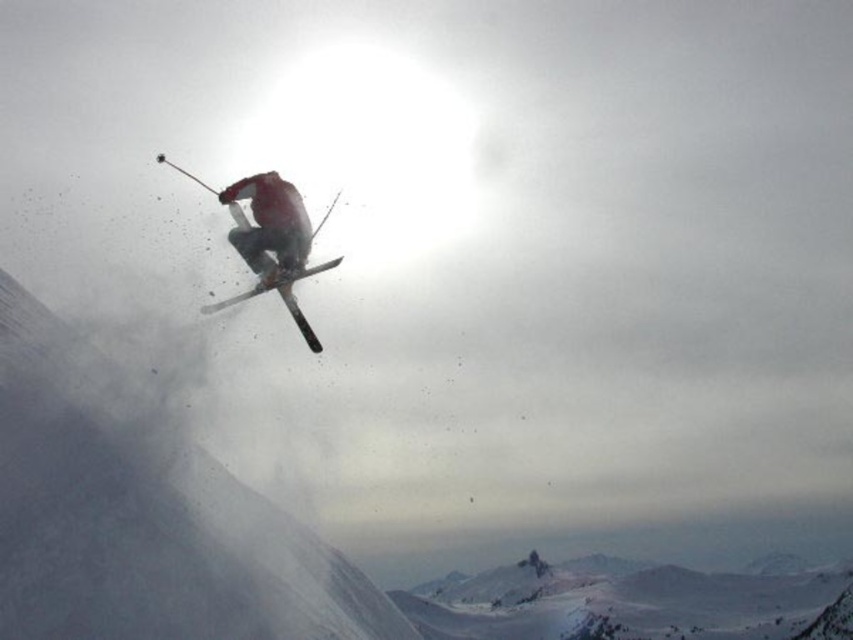
You are a photographer trying to capture the skier in the image. You notice the matte red ski suit at center and the shiny metallic ski at center. Which object would appear smaller in your photo?

The matte red ski suit at center appears smaller in the photo compared to the shiny metallic ski at center because it has a smaller size.